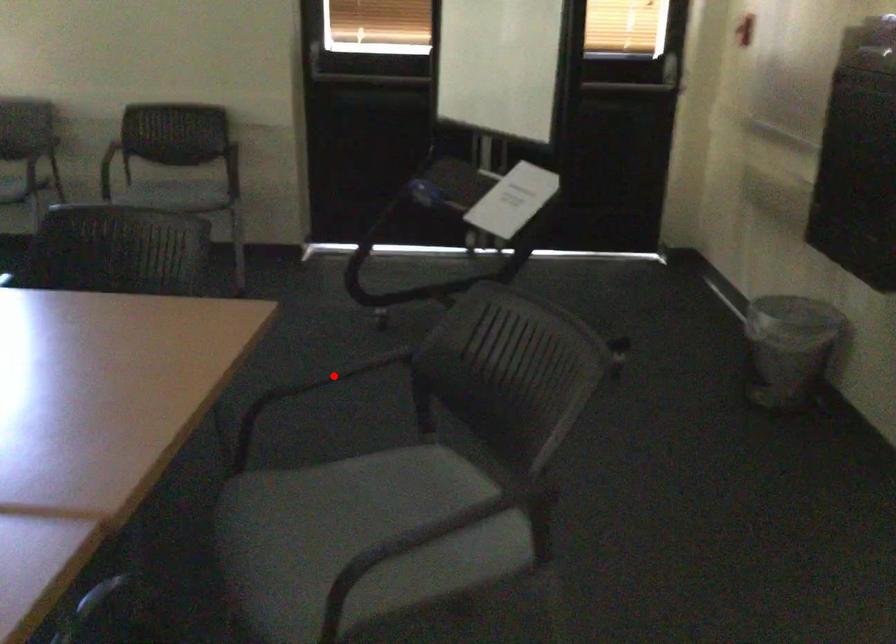
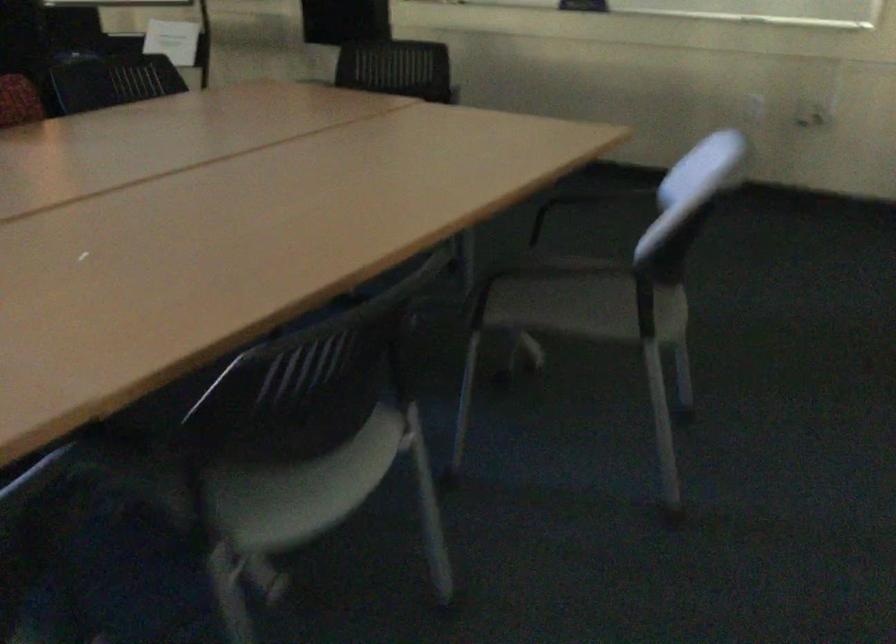
Question: I am providing you with two images of the same scene from different viewpoints. A red point is marked on the first image. Is the red point's position out of view in image 2?

Choices:
 (A) Yes
 (B) No

Answer: (A)